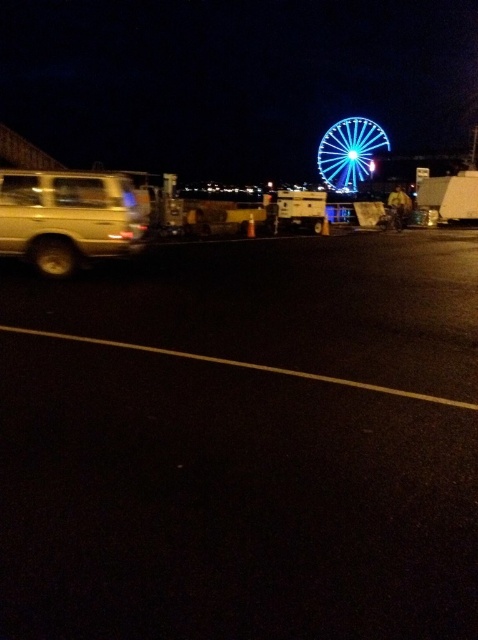
Who is positioned more to the left, blue illuminated ferris wheel at upper right or white plastic food truck at center?

white plastic food truck at center

Does blue illuminated ferris wheel at upper right have a greater height compared to white plastic food truck at center?

Correct, blue illuminated ferris wheel at upper right is much taller as white plastic food truck at center.

Is point (344, 147) more distant than point (308, 212)?

Yes, it is.

This screenshot has height=640, width=478. I want to click on blue illuminated ferris wheel at upper right, so click(x=349, y=152).

Between white plastic food truck at center and shiny metallic wheel at lower left, which one is positioned lower?

shiny metallic wheel at lower left is below.

Does white plastic food truck at center appear over shiny metallic wheel at lower left?

Yes.

Measure the distance between white plastic food truck at center and camera.

85.72 feet

Image resolution: width=478 pixels, height=640 pixels. What are the coordinates of `white plastic food truck at center` in the screenshot? It's located at (296, 209).

Between gold metallic suv at left and shiny metallic wheel at lower left, which one appears on the left side from the viewer's perspective?

shiny metallic wheel at lower left

Between gold metallic suv at left and shiny metallic wheel at lower left, which one is positioned higher?

gold metallic suv at left is above.

The width and height of the screenshot is (478, 640). Find the location of `gold metallic suv at left`. gold metallic suv at left is located at coordinates (67, 218).

This screenshot has height=640, width=478. In order to click on gold metallic suv at left in this screenshot , I will do `click(67, 218)`.